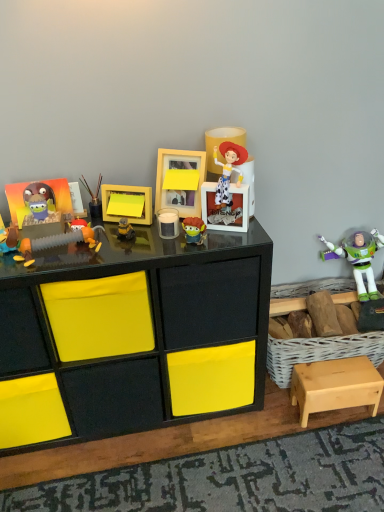
This screenshot has width=384, height=512. Find the location of `vacant region to the left of matte orange toy at center-left, which ranks as the 5th toy in right-to-left order`. vacant region to the left of matte orange toy at center-left, which ranks as the 5th toy in right-to-left order is located at coordinates click(38, 253).